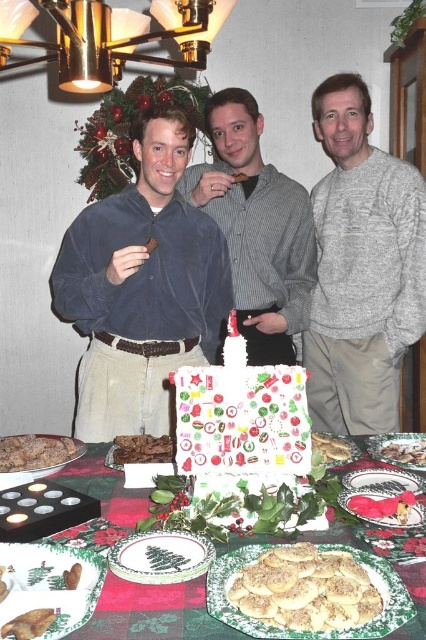
What is the 2D coordinate of the striped shirt at center?

The striped shirt at center is located at the 2D coordinate point of (256,227).

You are a guest at the festive gathering and want to grab a cookie from the table. You see the striped shirt at center and the crispy golden cookies at center. Which one is closer to you?

The crispy golden cookies at center are closer to you because the striped shirt at center is above them, indicating the cookies are lower and thus nearer.